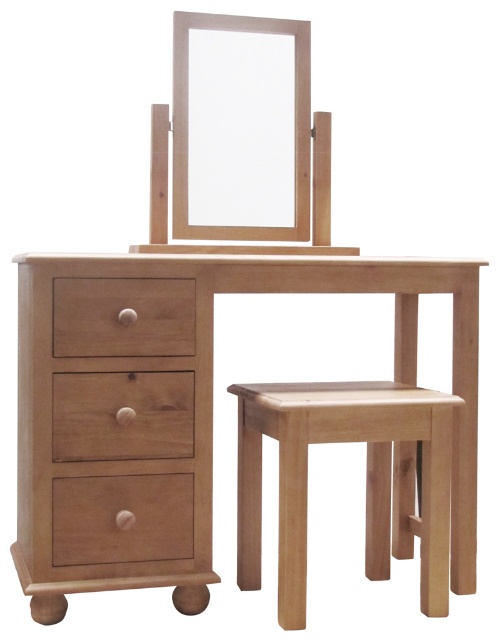
Question: Which point appears farthest from the camera in this image?

Choices:
 (A) (154, 492)
 (B) (182, 68)
 (C) (52, 332)
 (D) (463, 500)

Answer: (B)

Question: Is matte wood drawer at center positioned in front of matte wood mirror at center?

Choices:
 (A) yes
 (B) no

Answer: (A)

Question: Does natural wood table at center have a smaller size compared to matte wood drawer at center?

Choices:
 (A) yes
 (B) no

Answer: (B)

Question: Is wooden drawer at lower left to the left of matte wood drawer at lower left from the viewer's perspective?

Choices:
 (A) no
 (B) yes

Answer: (A)

Question: Among these points, which one is farthest from the camera?

Choices:
 (A) (115, 467)
 (B) (159, 349)
 (C) (301, 67)
 (D) (398, 512)

Answer: (D)

Question: Which is nearer to the matte wood drawer at center?

Choices:
 (A) natural wood stool at lower right
 (B) natural wood table at center
 (C) matte wood mirror at center
 (D) matte wood drawer at lower left

Answer: (B)